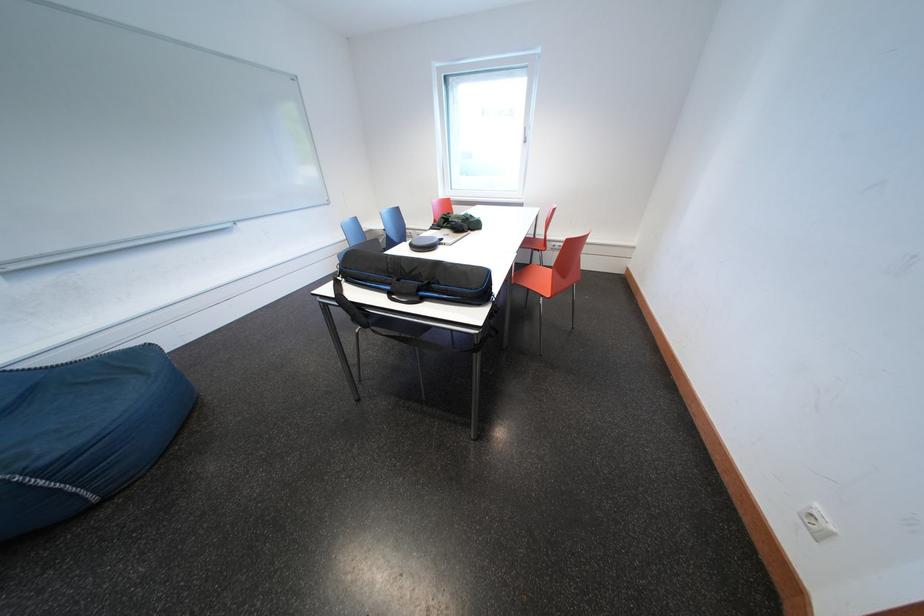
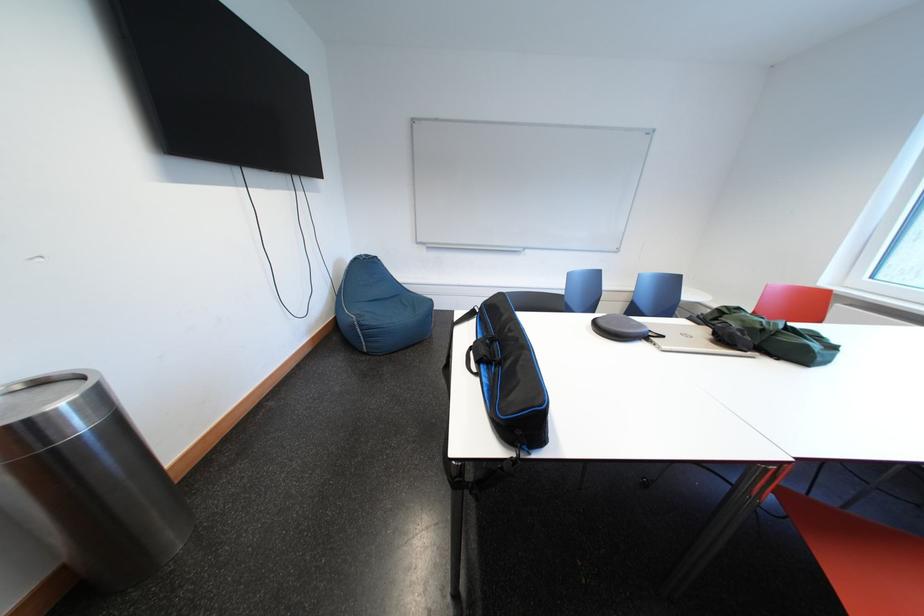
Where in the second image is the point corresponding to the point at 431,297 from the first image?

(492, 371)